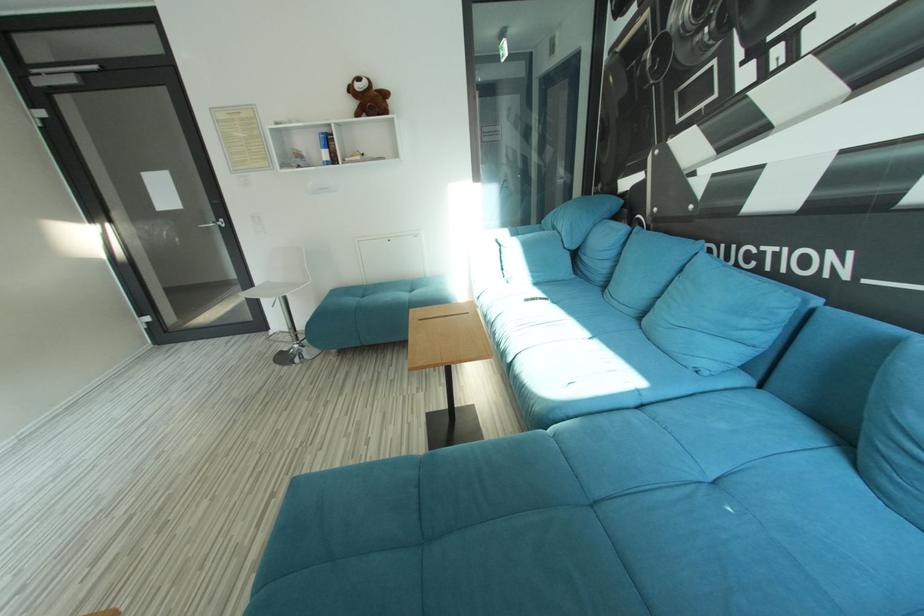
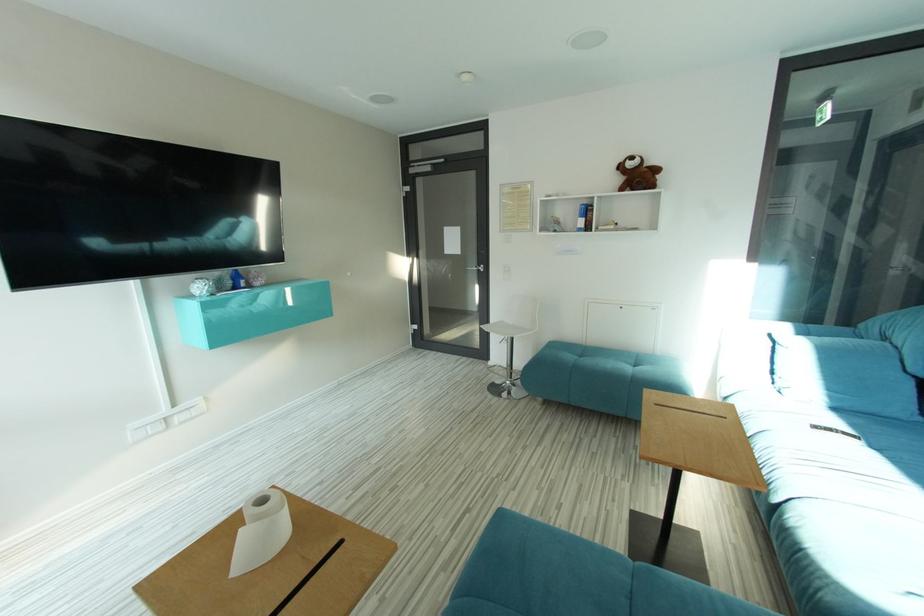
Question: Based on the continuous images, in which direction is the camera rotating? Reply with the corresponding letter.

Choices:
 (A) Left
 (B) Right
 (C) Up
 (D) Down

Answer: (A)